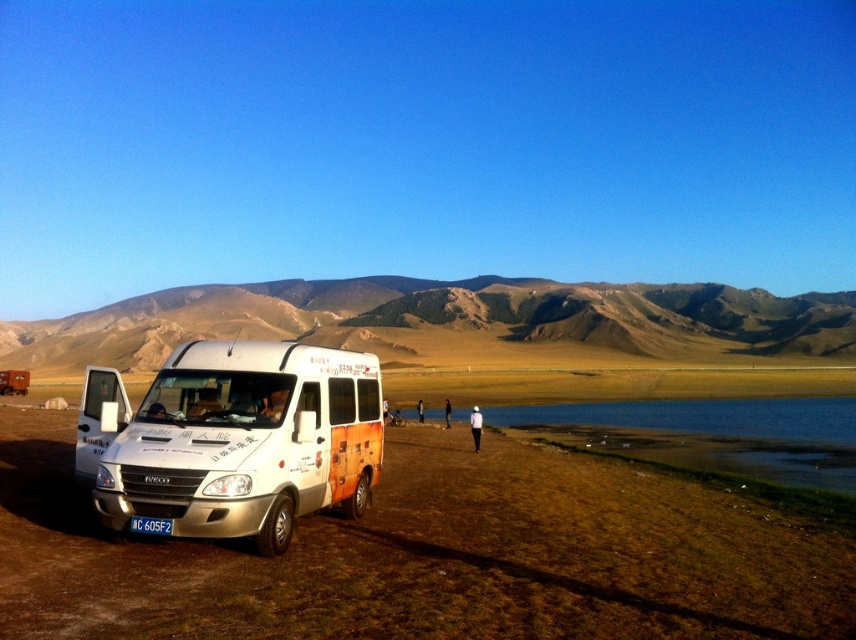
Question: Which point appears farthest from the camera in this image?

Choices:
 (A) (449, 406)
 (B) (795, 544)
 (C) (175, 508)

Answer: (A)

Question: Among these objects, which one is farthest from the camera?

Choices:
 (A) white plastic license plate at lower center
 (B) brown dirt field at lower left

Answer: (A)

Question: Is brown dirt field at lower left in front of white matte van at lower left?

Choices:
 (A) yes
 (B) no

Answer: (A)

Question: Where is white matte van at lower left located in relation to white fabric person at lower center in the image?

Choices:
 (A) right
 (B) left

Answer: (B)

Question: Which point is farther from the camera taking this photo?

Choices:
 (A) (135, 516)
 (B) (144, 458)
 (C) (156, 595)

Answer: (B)

Question: Can you confirm if white fabric person at lower center is thinner than black fabric person at center?

Choices:
 (A) yes
 (B) no

Answer: (B)